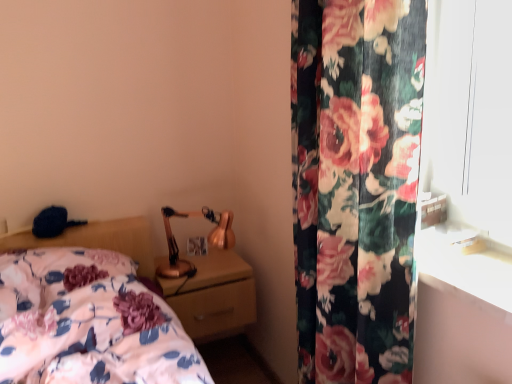
This screenshot has width=512, height=384. What do you see at coordinates (89, 312) in the screenshot? I see `floral fabric bed at lower left` at bounding box center [89, 312].

Measure the distance between matte gold nightstand at center and camera.

matte gold nightstand at center and camera are 1.73 meters apart from each other.

The image size is (512, 384). Describe the element at coordinates (207, 239) in the screenshot. I see `copper metallic table lamp at upper right` at that location.

The height and width of the screenshot is (384, 512). Find the location of `floral fabric bed at lower left`. floral fabric bed at lower left is located at coordinates (89, 312).

From a real-world perspective, is floral fabric bed at lower left below floral fabric curtain at right?

Yes, from a real-world perspective, floral fabric bed at lower left is under floral fabric curtain at right.

Can you confirm if floral fabric bed at lower left is wider than floral fabric curtain at right?

Correct, the width of floral fabric bed at lower left exceeds that of floral fabric curtain at right.

Is floral fabric curtain at right completely or partially inside floral fabric bed at lower left?

No, floral fabric curtain at right is not surrounded by floral fabric bed at lower left.

Is floral fabric bed at lower left to the right of floral fabric curtain at right from the viewer's perspective?

No.

From a real-world perspective, relative to matte gold nightstand at center, is floral fabric bed at lower left vertically above or below?

Clearly, from a real-world perspective, floral fabric bed at lower left is above matte gold nightstand at center.

Is floral fabric bed at lower left positioned with its back to matte gold nightstand at center?

floral fabric bed at lower left does not have its back to matte gold nightstand at center.

Would you consider floral fabric bed at lower left to be distant from matte gold nightstand at center?

No, floral fabric bed at lower left is in close proximity to matte gold nightstand at center.

Identify the location of nightstand below the floral fabric bed at lower left (from the image's perspective). (213, 295).

At what (x,y) coordinates should I click in order to perform the action: click on table lamp lying in front of the matte gold nightstand at center. Please return your answer as a coordinate pair (x, y). Image resolution: width=512 pixels, height=384 pixels. Looking at the image, I should click on (207, 239).

Does matte gold nightstand at center lie behind copper metallic table lamp at upper right?

Yes, it is behind copper metallic table lamp at upper right.

Who is shorter, matte gold nightstand at center or copper metallic table lamp at upper right?

With less height is matte gold nightstand at center.

Between point (199, 318) and point (187, 274), which one is positioned in front?

The point (199, 318) is closer to the camera.

Is floral fabric curtain at right to the left or to the right of copper metallic table lamp at upper right in the image?

floral fabric curtain at right is positioned on copper metallic table lamp at upper right's right side.

Considering the relative sizes of floral fabric curtain at right and copper metallic table lamp at upper right in the image provided, is floral fabric curtain at right wider than copper metallic table lamp at upper right?

Incorrect, the width of floral fabric curtain at right does not surpass that of copper metallic table lamp at upper right.

From a real-world perspective, is floral fabric curtain at right above or below copper metallic table lamp at upper right?

In terms of real-world spatial position, floral fabric curtain at right is above copper metallic table lamp at upper right.

Is point (230, 241) behind point (174, 288)?

Yes, point (230, 241) is behind point (174, 288).

Who is smaller, copper metallic table lamp at upper right or matte gold nightstand at center?

Smaller between the two is copper metallic table lamp at upper right.

From the image's perspective, would you say copper metallic table lamp at upper right is positioned over matte gold nightstand at center?

Yes.

From a real-world perspective, is copper metallic table lamp at upper right on top of floral fabric bed at lower left?

Indeed, from a real-world perspective, copper metallic table lamp at upper right stands above floral fabric bed at lower left.

How many degrees apart are the facing directions of copper metallic table lamp at upper right and floral fabric bed at lower left?

The angular difference between copper metallic table lamp at upper right and floral fabric bed at lower left is 0.649 degrees.

Is copper metallic table lamp at upper right inside or outside of floral fabric bed at lower left?

copper metallic table lamp at upper right is located beyond the bounds of floral fabric bed at lower left.

Can you confirm if floral fabric curtain at right is shorter than matte gold nightstand at center?

In fact, floral fabric curtain at right may be taller than matte gold nightstand at center.

Does floral fabric curtain at right have a lesser width compared to matte gold nightstand at center?

Yes.

From a real-world perspective, who is located lower, floral fabric curtain at right or matte gold nightstand at center?

In real-world perspective, matte gold nightstand at center is lower.

How many degrees apart are the facing directions of floral fabric curtain at right and matte gold nightstand at center?

The angular difference between floral fabric curtain at right and matte gold nightstand at center is 89.4 degrees.

This screenshot has height=384, width=512. In order to click on bed below the floral fabric curtain at right (from a real-world perspective) in this screenshot , I will do `click(89, 312)`.

Find the location of a particular element. bed above the matte gold nightstand at center (from a real-world perspective) is located at coordinates (89, 312).

From the image, which object appears to be farther from matte gold nightstand at center, copper metallic table lamp at upper right or floral fabric curtain at right?

floral fabric curtain at right lies further to matte gold nightstand at center than the other object.

From the image, which object appears to be nearer to floral fabric bed at lower left, matte gold nightstand at center or copper metallic table lamp at upper right?

matte gold nightstand at center lies closer to floral fabric bed at lower left than the other object.

When comparing their distances from floral fabric curtain at right, does copper metallic table lamp at upper right or matte gold nightstand at center seem further?

The object further to floral fabric curtain at right is copper metallic table lamp at upper right.

Considering their positions, is floral fabric curtain at right positioned closer to copper metallic table lamp at upper right than floral fabric bed at lower left?

floral fabric bed at lower left.

Estimate the real-world distances between objects in this image. Which object is further from matte gold nightstand at center, floral fabric curtain at right or floral fabric bed at lower left?

floral fabric curtain at right lies further to matte gold nightstand at center than the other object.

Which object lies nearer to the anchor point copper metallic table lamp at upper right, floral fabric bed at lower left or floral fabric curtain at right?

floral fabric bed at lower left is closer to copper metallic table lamp at upper right.

Based on their spatial positions, is floral fabric bed at lower left or floral fabric curtain at right closer to matte gold nightstand at center?

floral fabric bed at lower left is positioned closer to the anchor matte gold nightstand at center.

Considering their positions, is floral fabric bed at lower left positioned further to copper metallic table lamp at upper right than matte gold nightstand at center?

floral fabric bed at lower left is positioned further to the anchor copper metallic table lamp at upper right.

Identify the location of table lamp between floral fabric bed at lower left and floral fabric curtain at right from left to right. The width and height of the screenshot is (512, 384). (207, 239).

Identify the location of table lamp between floral fabric bed at lower left and matte gold nightstand at center in the front-back direction. This screenshot has height=384, width=512. (207, 239).

The height and width of the screenshot is (384, 512). In order to click on bed positioned between floral fabric curtain at right and matte gold nightstand at center from near to far in this screenshot , I will do `click(89, 312)`.

Locate an element on the screen. table lamp between floral fabric curtain at right and matte gold nightstand at center in the front-back direction is located at coordinates (207, 239).